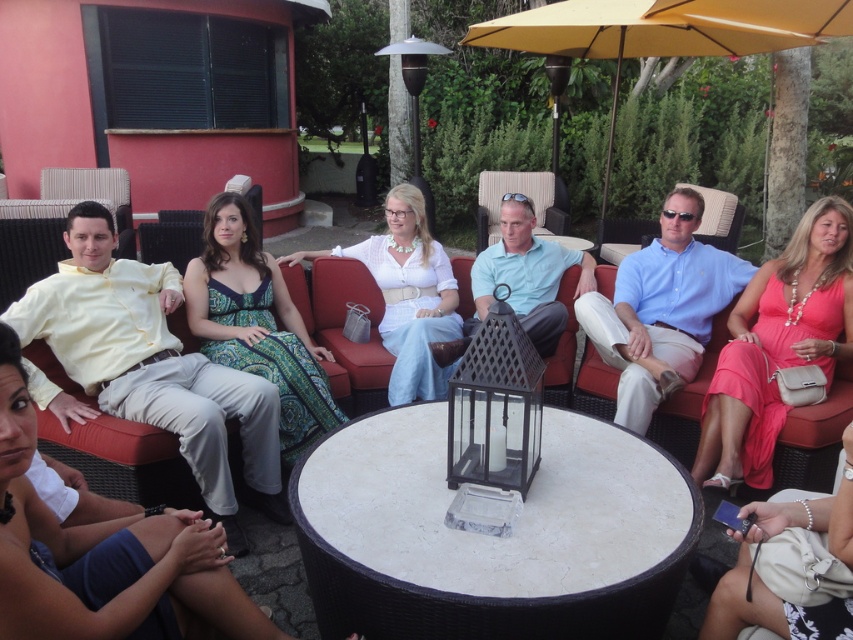
Measure the distance between yellow cotton shirt at left and camera.

yellow cotton shirt at left and camera are 2.75 meters apart.

Which is above, yellow cotton shirt at left or light blue shirt at center?

light blue shirt at center is higher up.

Between point (138, 376) and point (630, 364), which one is positioned behind?

The point (630, 364) is more distant.

Where is `yellow cotton shirt at left`? This screenshot has width=853, height=640. yellow cotton shirt at left is located at coordinates (152, 365).

Can you confirm if yellow cotton shirt at left is positioned to the left of white cotton dress at center?

Correct, you'll find yellow cotton shirt at left to the left of white cotton dress at center.

Who is positioned more to the right, yellow cotton shirt at left or white cotton dress at center?

Positioned to the right is white cotton dress at center.

Is point (173, 401) positioned after point (381, 332)?

No, it is in front of (381, 332).

Locate an element on the screen. yellow cotton shirt at left is located at coordinates (152, 365).

You are a GUI agent. You are given a task and a screenshot of the screen. Output one action in this format:
    pyautogui.click(x=<x>, y=<y>)
    Task: Click on the matte white dress at center
    
    Given the screenshot: What is the action you would take?
    pyautogui.click(x=123, y=460)

What are the coordinates of `matte white dress at center` in the screenshot? It's located at (123, 460).

Find the location of a particular element. matte white dress at center is located at coordinates (123, 460).